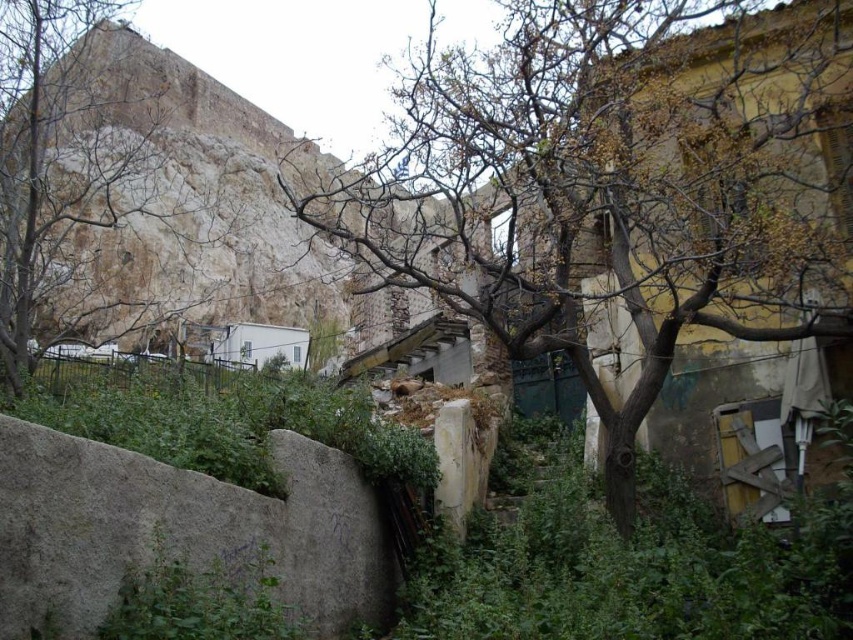
Question: Observing the image, what is the correct spatial positioning of brown rough bark tree at center in reference to gray rough stone at lower left?

Choices:
 (A) below
 (B) above

Answer: (B)

Question: Is rustic stone mountain at upper left positioned before gray rough stone at lower left?

Choices:
 (A) no
 (B) yes

Answer: (A)

Question: Considering the real-world distances, which object is farthest from the brown rough bark tree at center?

Choices:
 (A) gray rough stone at lower left
 (B) rustic stone mountain at upper left

Answer: (B)

Question: Considering the real-world distances, which object is closest to the rustic stone mountain at upper left?

Choices:
 (A) brown rough bark tree at center
 (B) gray rough stone at lower left

Answer: (A)

Question: Which of these objects is positioned closest to the rustic stone mountain at upper left?

Choices:
 (A) brown rough bark tree at center
 (B) gray rough stone at lower left

Answer: (A)

Question: Is brown rough bark tree at center thinner than gray rough stone at lower left?

Choices:
 (A) no
 (B) yes

Answer: (A)